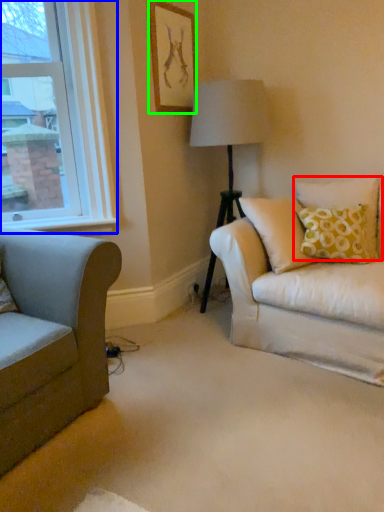
Question: Based on their relative distances, which object is farther from pillow (highlighted by a red box)? Choose from window (highlighted by a blue box) and picture frame (highlighted by a green box).

Choices:
 (A) window
 (B) picture frame

Answer: (A)